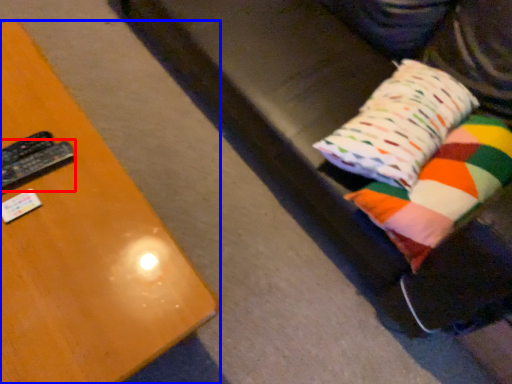
Question: Which point is closer to the camera, remote (highlighted by a red box) or furniture (highlighted by a blue box)?

Choices:
 (A) remote
 (B) furniture

Answer: (B)